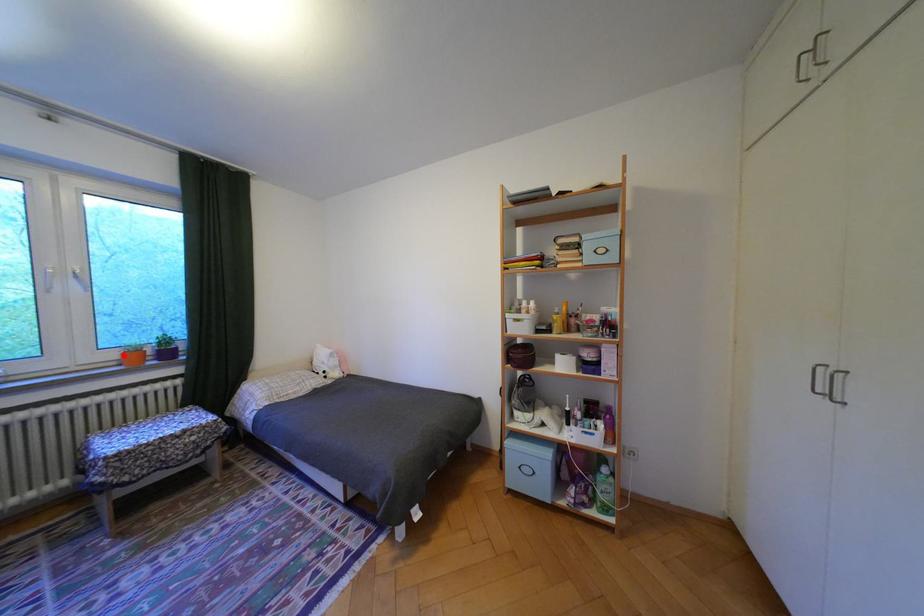
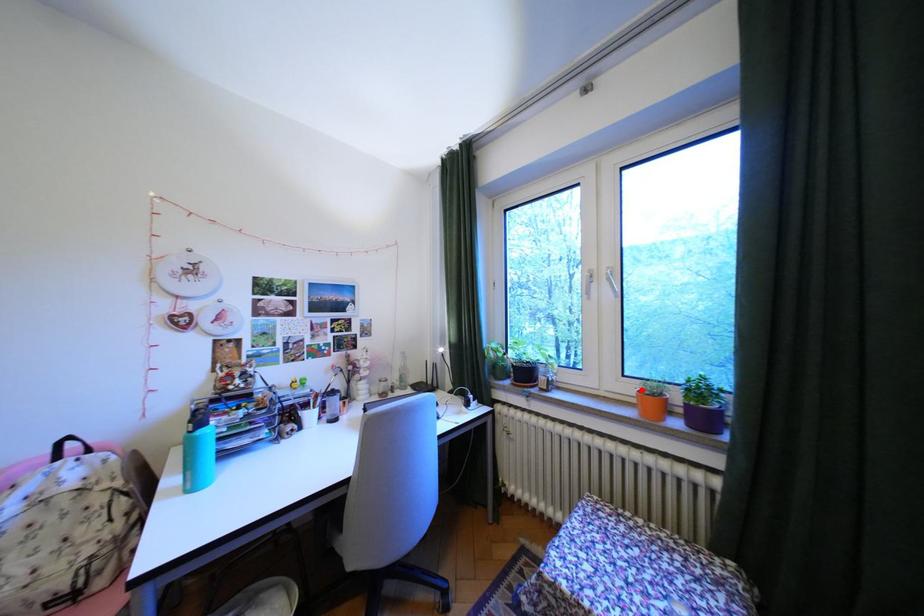
I am providing you with two images of the same scene from different viewpoints. A red point is marked on the first image and another point is marked on the second image. Do the highlighted points in image1 and image2 indicate the same real-world spot?

Yes